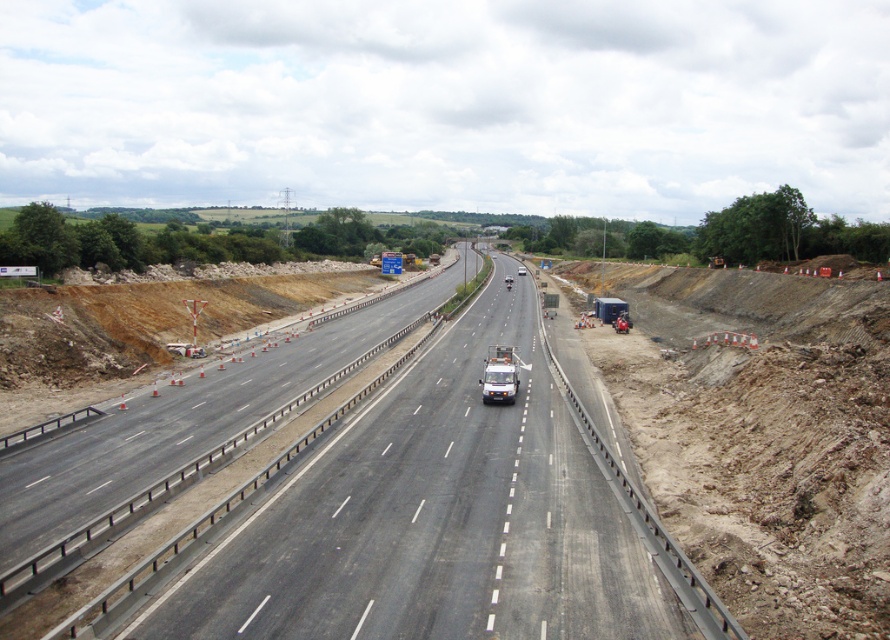
Question: Which point is farther from the camera taking this photo?

Choices:
 (A) (608, 323)
 (B) (374, 620)

Answer: (A)

Question: Is asphalt road at center wider than matte black trailer truck at center?

Choices:
 (A) no
 (B) yes

Answer: (B)

Question: Observing the image, what is the correct spatial positioning of asphalt road at center in reference to matte black trailer truck at center?

Choices:
 (A) above
 (B) below

Answer: (B)

Question: Does asphalt road at center have a larger size compared to matte black trailer truck at center?

Choices:
 (A) no
 (B) yes

Answer: (B)

Question: Which point is farther to the camera?

Choices:
 (A) matte black trailer truck at center
 (B) asphalt road at center

Answer: (A)